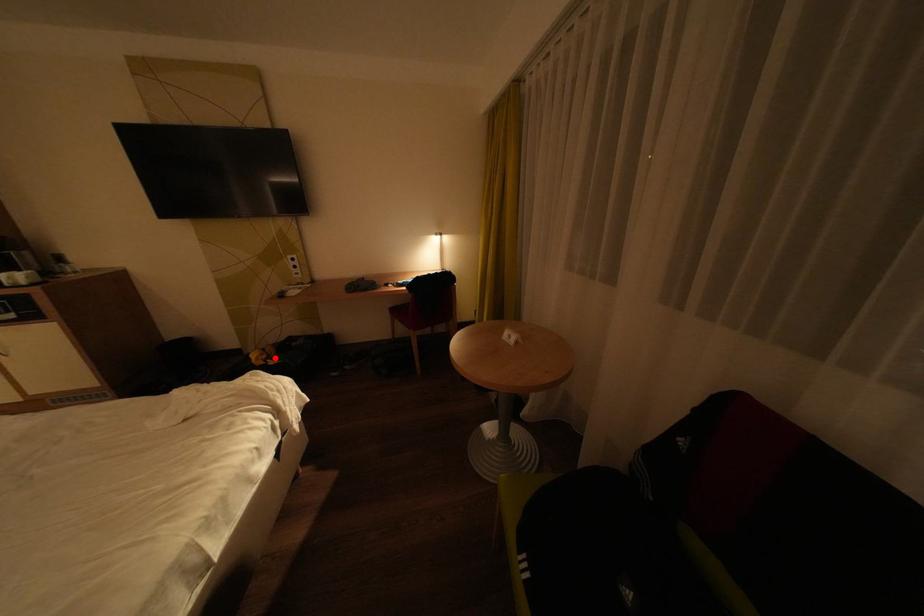
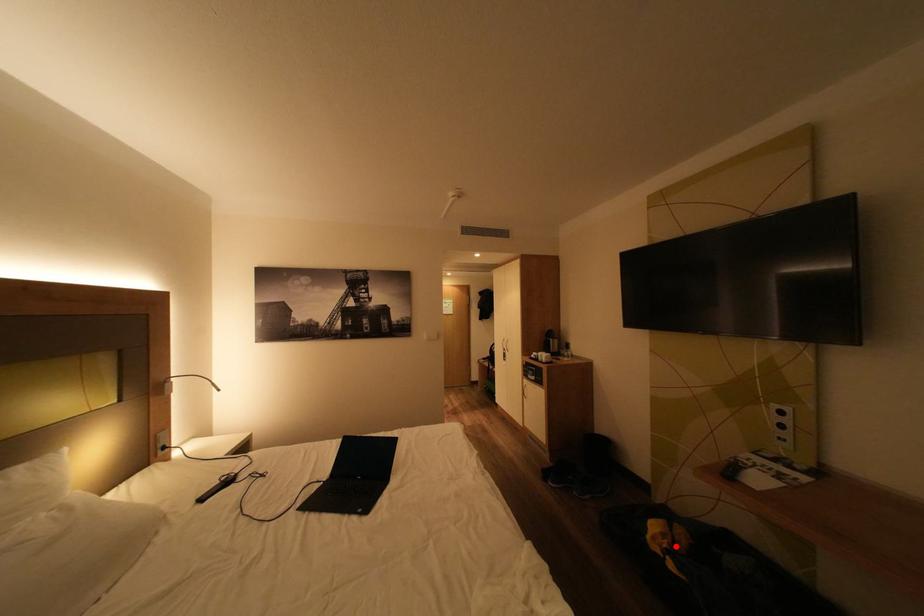
I am providing you with two images of the same scene from different viewpoints. A red point is marked on the first image and another point is marked on the second image. Are the points marked in image1 and image2 representing the same 3D position?

Yes